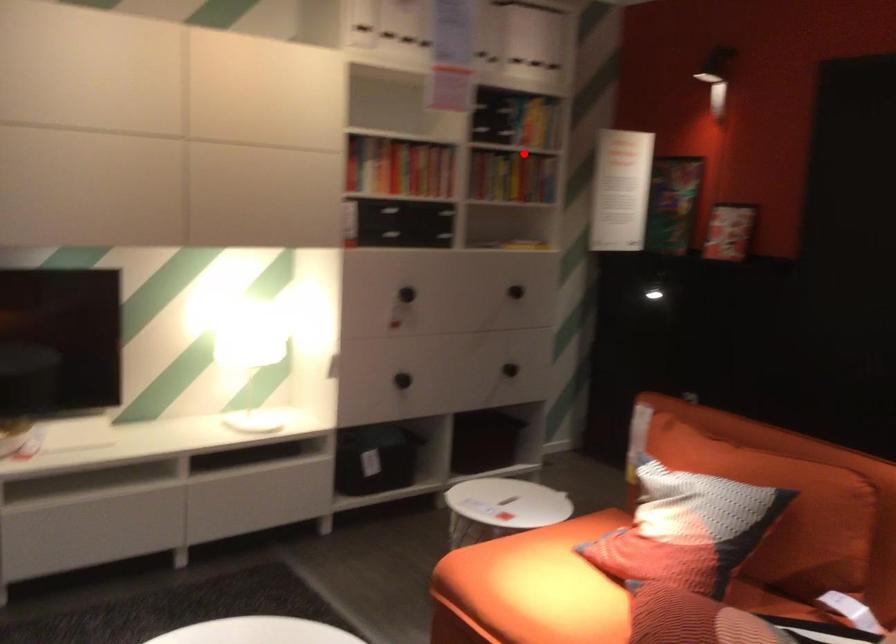
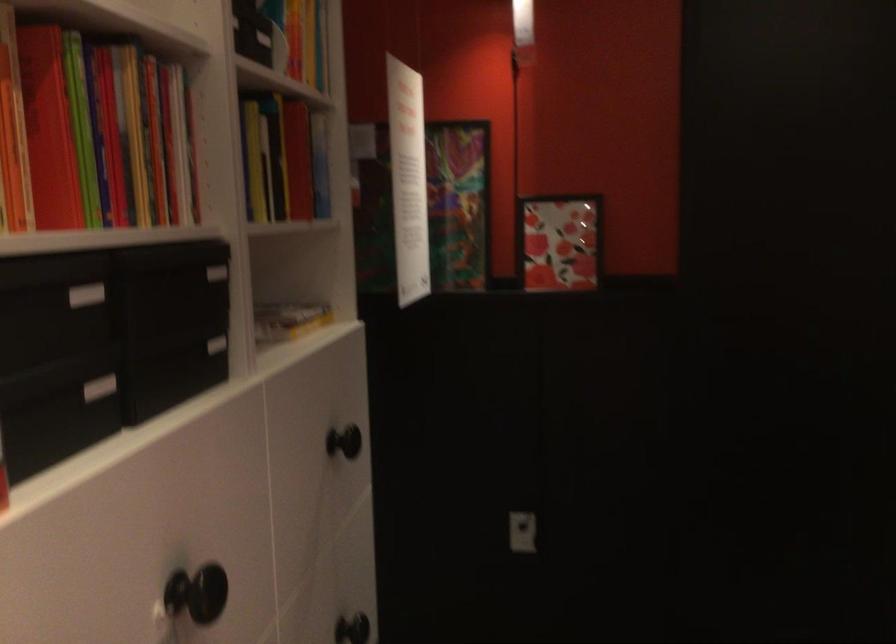
Question: A red point is marked in image1. In image2, is the corresponding 3D point closer to the camera or farther? Reply with the corresponding letter.

Choices:
 (A) The corresponding 3D point is closer.
 (B) The corresponding 3D point is farther.

Answer: (A)